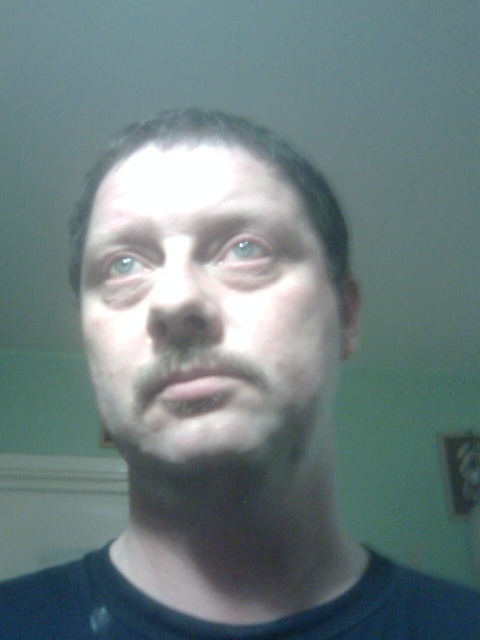
You are a photographer adjusting the lighting for a portrait session. You notice the matte skin face at center and the blue matte eye at center in your viewfinder. Based on their sizes in the frame, which one would require more space vertically to fully capture without cropping?

The matte skin face at center is taller than the blue matte eye at center, so it would require more vertical space to fully capture without cropping.

Based on the scene description, which object is wider between the gray matte eyebrow at upper left and the blue matte eye at center?

The gray matte eyebrow at upper left is wider than the blue matte eye at center according to the description.

You are a photographer adjusting the lighting for a portrait session. You notice the matte skin face at center and the blue matte eye at center in your viewfinder. Which object will require more focused lighting adjustments to ensure proper exposure?

The blue matte eye at center requires more focused lighting adjustments because it is smaller than the matte skin face at center, making it more challenging to capture details in the limited space.